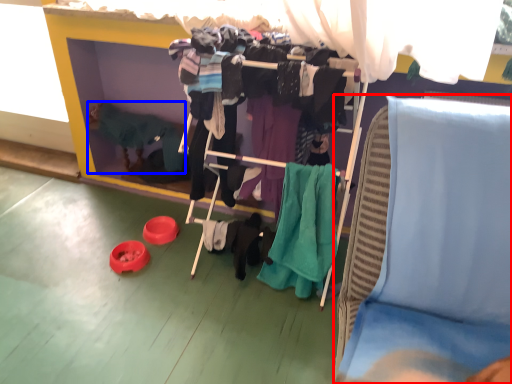
Question: Which point is further to the camera, furniture (highlighted by a red box) or person (highlighted by a blue box)?

Choices:
 (A) furniture
 (B) person

Answer: (B)